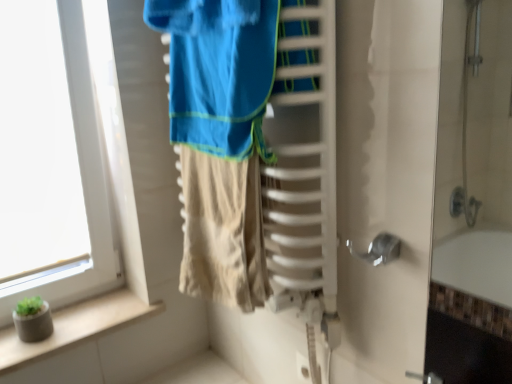
Locate an element on the screen. The height and width of the screenshot is (384, 512). blank space situated above green concrete planter at lower left (from a real-world perspective) is located at coordinates coord(91,312).